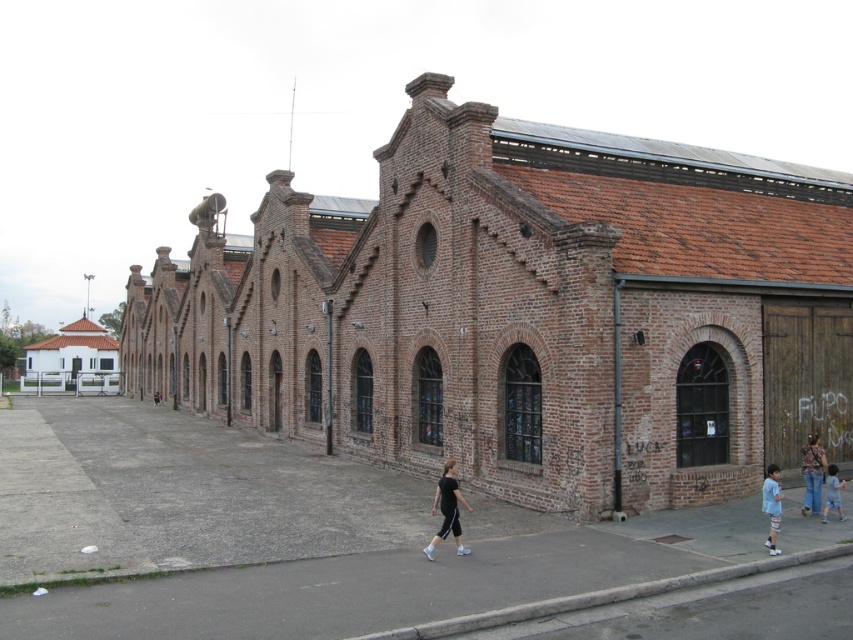
Who is positioned more to the right, black matte pants at center or light blue denim shorts at lower right?

Positioned to the right is light blue denim shorts at lower right.

Who is higher up, black matte pants at center or light blue denim shorts at lower right?

black matte pants at center is above.

What do you see at coordinates (447, 509) in the screenshot? I see `black matte pants at center` at bounding box center [447, 509].

Where is `black matte pants at center`? black matte pants at center is located at coordinates (447, 509).

Is black matte pants at center below patterned fabric shirt at lower right?

Actually, black matte pants at center is above patterned fabric shirt at lower right.

Who is taller, black matte pants at center or patterned fabric shirt at lower right?

patterned fabric shirt at lower right is taller.

You are a GUI agent. You are given a task and a screenshot of the screen. Output one action in this format:
    pyautogui.click(x=<x>, y=<y>)
    Task: Click on the black matte pants at center
    
    Given the screenshot: What is the action you would take?
    pyautogui.click(x=447, y=509)

From the picture: Between brown brick alley at center and black matte pants at center, which one has less height?

Standing shorter between the two is brown brick alley at center.

Who is lower down, brown brick alley at center or black matte pants at center?

Positioned lower is brown brick alley at center.

I want to click on brown brick alley at center, so tap(281, 536).

At what (x,y) coordinates should I click in order to perform the action: click on brown brick alley at center. Please return your answer as a coordinate pair (x, y). The height and width of the screenshot is (640, 853). Looking at the image, I should click on (281, 536).